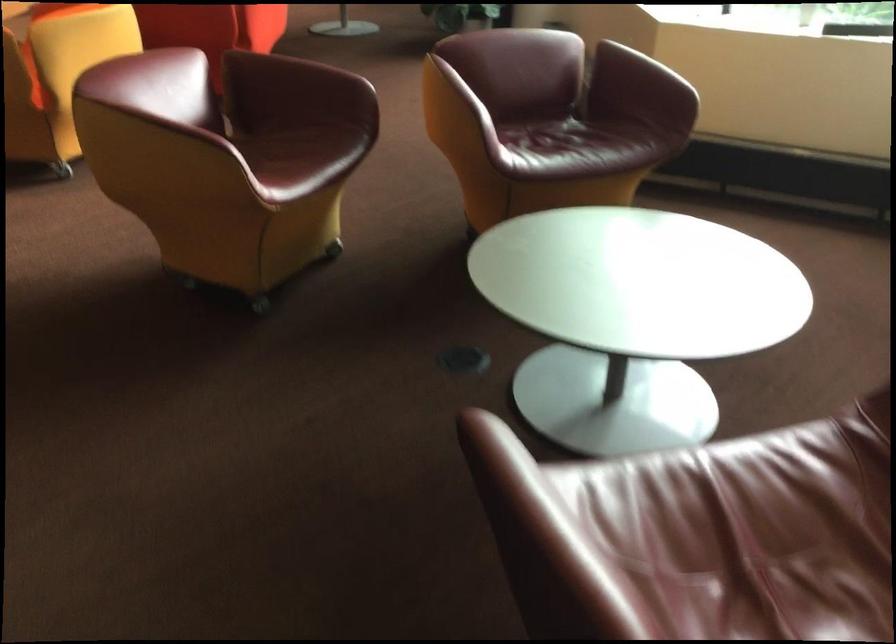
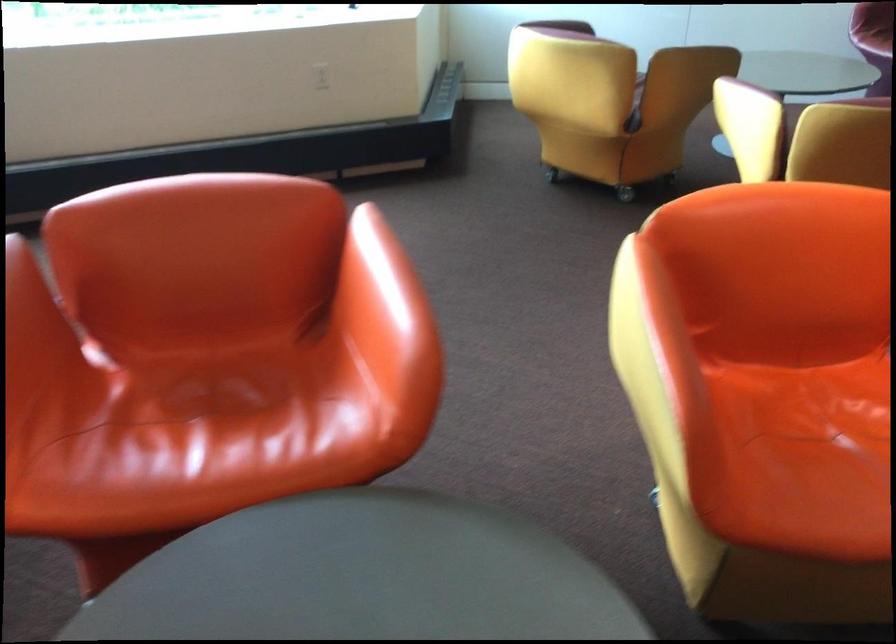
Question: I am providing you with two images of the same scene from different viewpoints. After the viewpoint changes to image2, which objects are now occluded?

Choices:
 (A) orange chair sitting surface
 (B) purple chair sitting surface
 (C) purple lamp head
 (D) red chair sitting surface

Answer: (D)